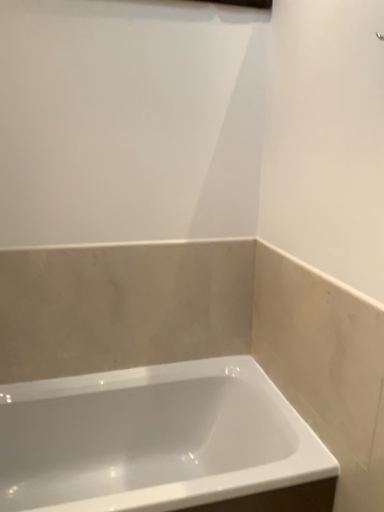
The width and height of the screenshot is (384, 512). What do you see at coordinates (153, 439) in the screenshot?
I see `white glossy bathtub at center` at bounding box center [153, 439].

Find the location of a particular element. The image size is (384, 512). white glossy bathtub at center is located at coordinates (153, 439).

At what (x,y) coordinates should I click in order to perform the action: click on white glossy bathtub at center. Please return your answer as a coordinate pair (x, y). This screenshot has height=512, width=384. Looking at the image, I should click on (153, 439).